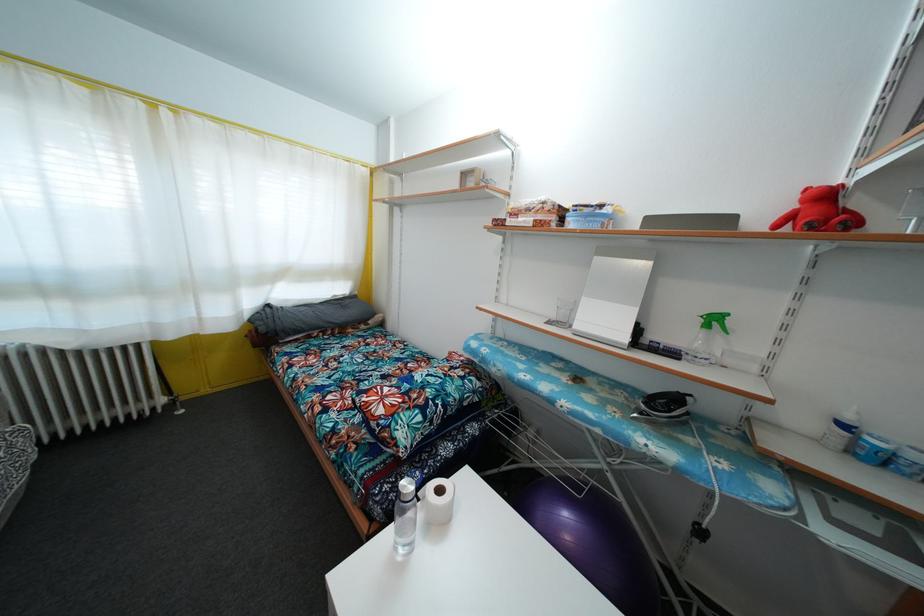
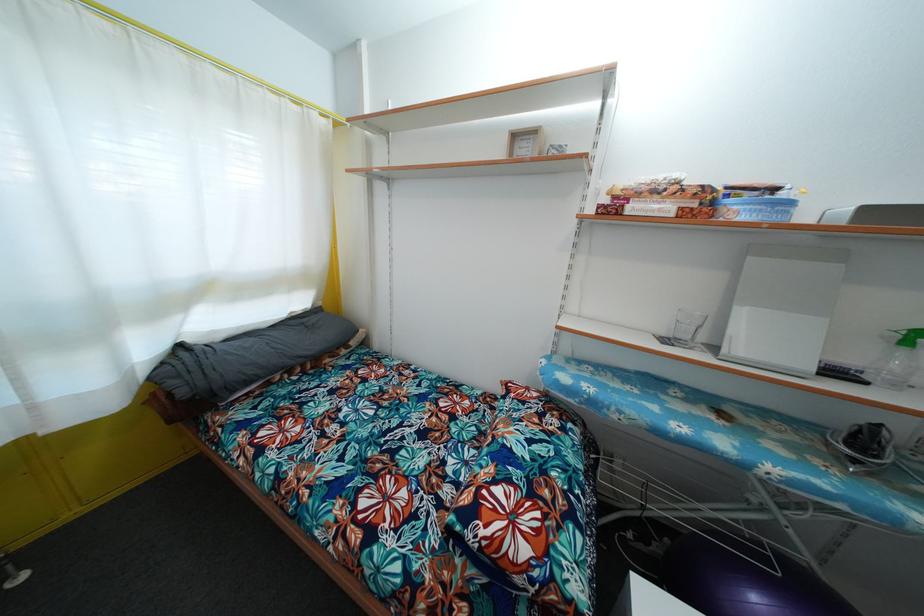
In the second image, find the point that corresponds to (548,209) in the first image.

(683, 188)